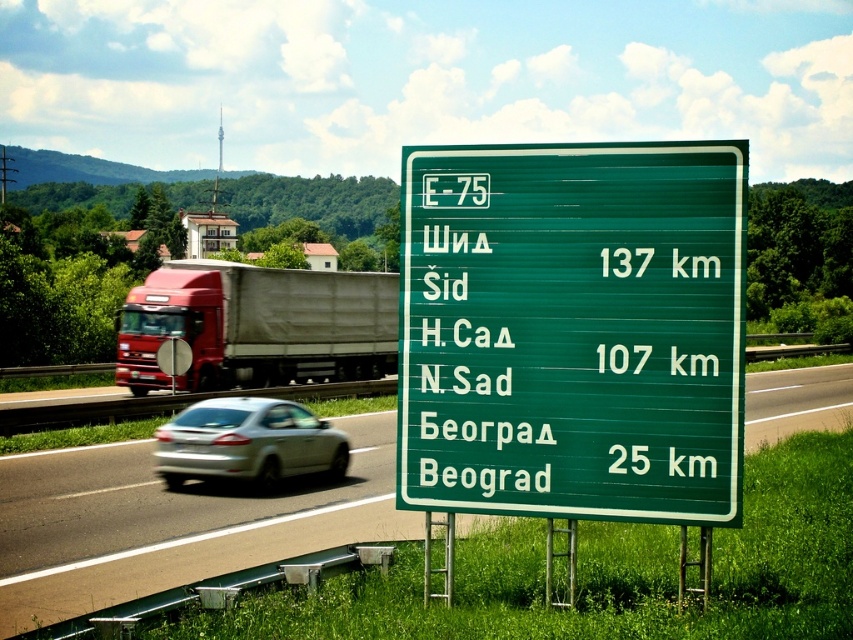
Who is lower down, green plastic sign at center or green signpost at center?

green signpost at center is lower down.

Is point (550, 224) behind point (368, 451)?

No, (550, 224) is closer to viewer.

Locate an element on the screen. green plastic sign at center is located at coordinates (572, 330).

This screenshot has width=853, height=640. What do you see at coordinates (167, 524) in the screenshot?
I see `green signpost at center` at bounding box center [167, 524].

Is green signpost at center further to the viewer compared to red matte trailer truck at left?

That is False.

In order to click on green signpost at center in this screenshot , I will do `click(167, 524)`.

Does green plastic sign at center have a lesser height compared to silver metallic sedan at center?

No.

Does green plastic sign at center appear over silver metallic sedan at center?

Yes.

Is point (585, 268) more distant than point (233, 412)?

No, (585, 268) is closer to viewer.

Locate an element on the screen. green plastic sign at center is located at coordinates (572, 330).